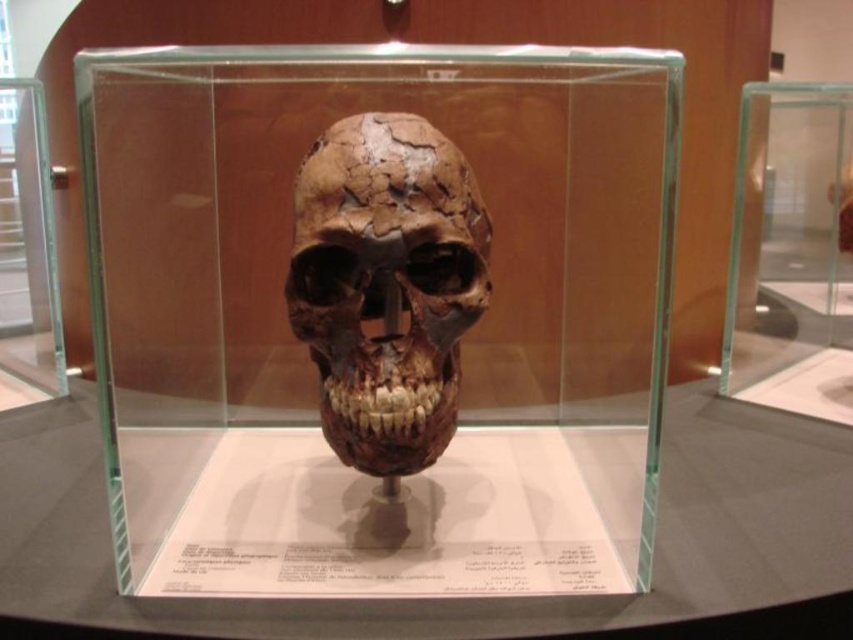
Question: Which object is closer to the camera taking this photo?

Choices:
 (A) transparent glass table at center
 (B) brown cracked bone skull at center

Answer: (A)

Question: Where is transparent glass skull at center located in relation to brown cracked bone skull at center in the image?

Choices:
 (A) left
 (B) right

Answer: (A)

Question: Which object appears farthest from the camera in this image?

Choices:
 (A) transparent glass skull at center
 (B) brown cracked bone skull at center
 (C) transparent glass table at center

Answer: (B)

Question: Observing the image, what is the correct spatial positioning of transparent glass skull at center in reference to brown cracked bone skull at center?

Choices:
 (A) left
 (B) right

Answer: (A)

Question: Is transparent glass table at center closer to the viewer compared to brown cracked bone skull at center?

Choices:
 (A) yes
 (B) no

Answer: (A)

Question: Which point appears farthest from the camera in this image?

Choices:
 (A) (352, 404)
 (B) (129, 276)
 (C) (753, 474)

Answer: (B)